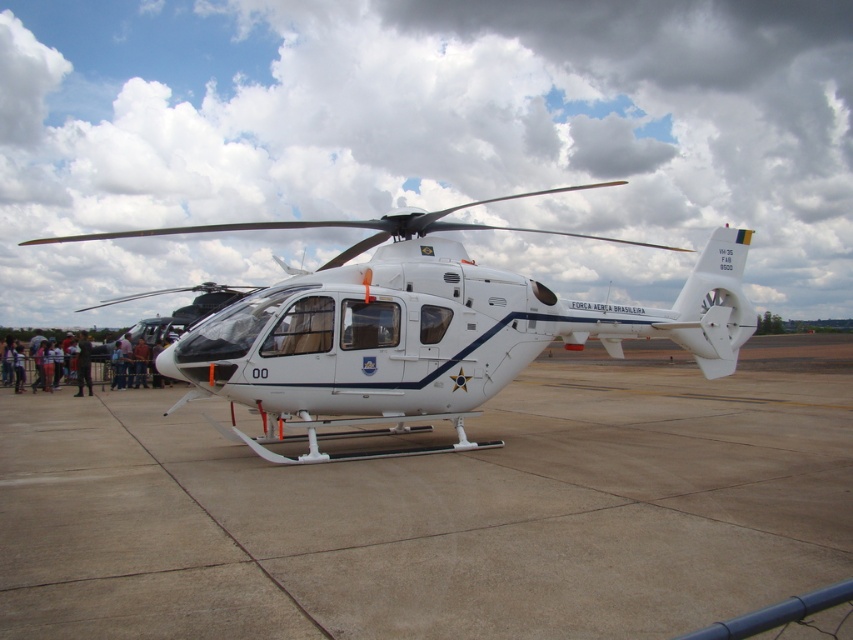
Question: Which point is closer to the camera?

Choices:
 (A) (85, 332)
 (B) (437, 534)

Answer: (B)

Question: Does white matte helicopter at center appear under dark blue fabric pants at lower left?

Choices:
 (A) no
 (B) yes

Answer: (A)

Question: Is white matte helicopter at center wider than dark blue fabric pants at lower left?

Choices:
 (A) no
 (B) yes

Answer: (B)

Question: Which point appears farthest from the camera in this image?

Choices:
 (A) (653, 451)
 (B) (289, 305)

Answer: (A)

Question: Can you confirm if white matte helicopter at center is wider than dark blue fabric pants at lower left?

Choices:
 (A) yes
 (B) no

Answer: (A)

Question: Which point is closer to the camera?

Choices:
 (A) (714, 344)
 (B) (77, 362)
 (C) (347, 609)

Answer: (C)